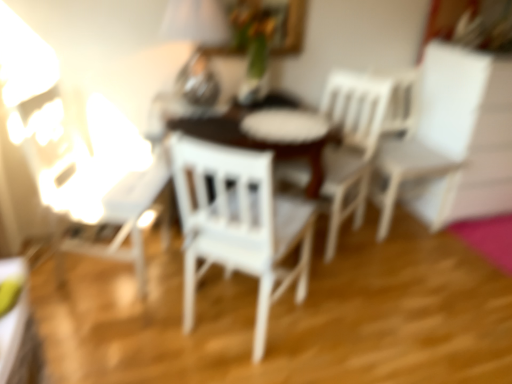
Question: From the image's perspective, is metallic silver table lamp at upper center beneath white matte chair at right, which appears as the third chair when viewed from the left?

Choices:
 (A) no
 (B) yes

Answer: (A)

Question: From a real-world perspective, is metallic silver table lamp at upper center over white matte chair at right, which is counted as the first chair, starting from the right?

Choices:
 (A) no
 (B) yes

Answer: (B)

Question: Would you say white matte chair at right, which is counted as the first chair, starting from the right, is part of metallic silver table lamp at upper center's contents?

Choices:
 (A) yes
 (B) no

Answer: (B)

Question: Considering the relative sizes of metallic silver table lamp at upper center and white matte chair at right, which appears as the third chair when viewed from the left, in the image provided, is metallic silver table lamp at upper center thinner than white matte chair at right, which appears as the third chair when viewed from the left,?

Choices:
 (A) no
 (B) yes

Answer: (B)

Question: Does metallic silver table lamp at upper center appear on the right side of white matte chair at right, which is counted as the first chair, starting from the right?

Choices:
 (A) yes
 (B) no

Answer: (B)

Question: Relative to metallic silver table lamp at upper center, is white wood chair at center, positioned as the second chair in right-to-left order, in front or behind?

Choices:
 (A) front
 (B) behind

Answer: (B)

Question: Considering the positions of white wood chair at center, the 2th chair when ordered from left to right, and metallic silver table lamp at upper center in the image, is white wood chair at center, the 2th chair when ordered from left to right, wider or thinner than metallic silver table lamp at upper center?

Choices:
 (A) thin
 (B) wide

Answer: (B)

Question: In the image, is white wood chair at center, the 2th chair when ordered from left to right, on the left side or the right side of metallic silver table lamp at upper center?

Choices:
 (A) left
 (B) right

Answer: (B)

Question: Is point (378, 97) closer or farther from the camera than point (188, 61)?

Choices:
 (A) closer
 (B) farther

Answer: (B)

Question: Is point (335, 236) closer or farther from the camera than point (252, 254)?

Choices:
 (A) farther
 (B) closer

Answer: (A)

Question: In the image, is white wood chair at center, positioned as the second chair in right-to-left order, positioned in front of or behind white wood chair at center, which appears as the 1th chair when viewed from the left?

Choices:
 (A) front
 (B) behind

Answer: (B)

Question: Looking at the image, does white wood chair at center, the 2th chair when ordered from left to right, seem bigger or smaller compared to white wood chair at center, which appears as the 1th chair when viewed from the left?

Choices:
 (A) small
 (B) big

Answer: (A)

Question: Choose the correct answer: Is white wood chair at center, positioned as the second chair in right-to-left order, inside white wood chair at center, the 3th chair when ordered from right to left, or outside it?

Choices:
 (A) outside
 (B) inside

Answer: (A)

Question: From a real-world perspective, is white wood chair at center, the 3th chair when ordered from right to left, above or below white wood chair at center, positioned as the second chair in right-to-left order?

Choices:
 (A) below
 (B) above

Answer: (B)

Question: Is white wood chair at center, the 3th chair when ordered from right to left, inside the boundaries of white wood chair at center, positioned as the second chair in right-to-left order, or outside?

Choices:
 (A) outside
 (B) inside

Answer: (A)